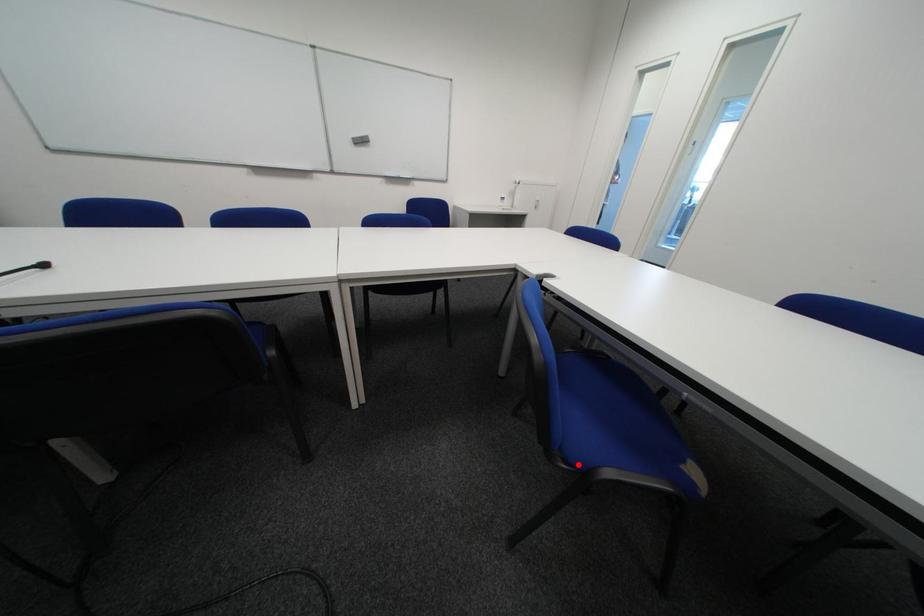
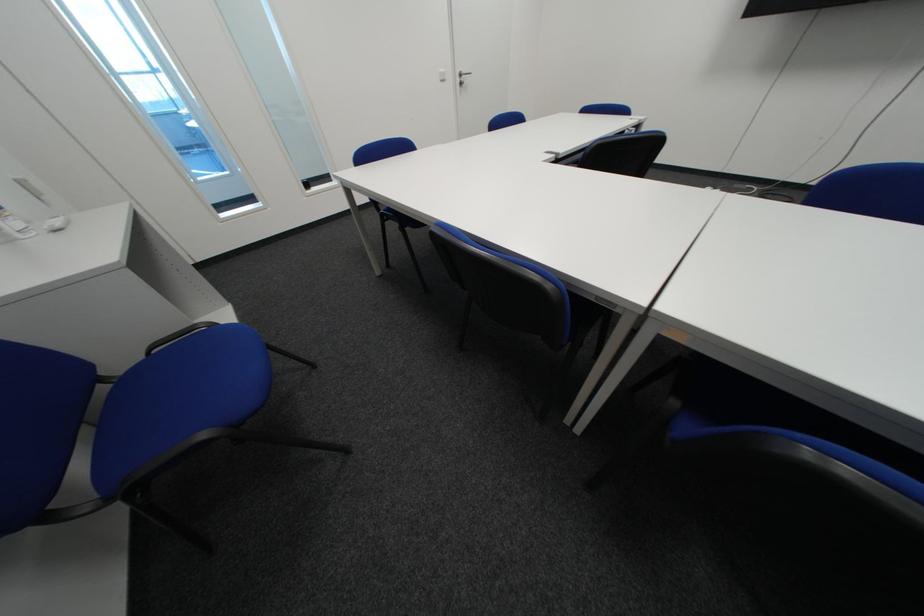
Question: I am providing you with two images of the same scene from different viewpoints. A red point is marked on the first image. Is the red point's position out of view in image 2?

Choices:
 (A) Yes
 (B) No

Answer: (A)